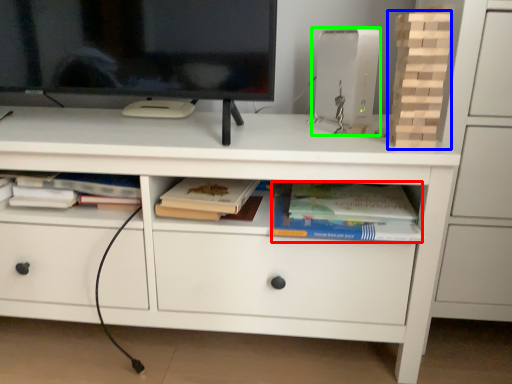
Question: Considering the real-world distances, which object is closest to paperback book (highlighted by a red box)? book (highlighted by a blue box) or equipment (highlighted by a green box).

Choices:
 (A) book
 (B) equipment

Answer: (A)